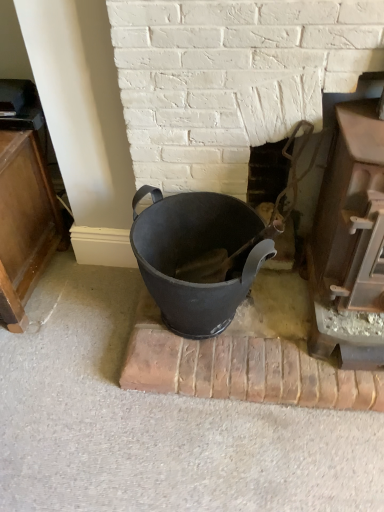
Image resolution: width=384 pixels, height=512 pixels. Find the location of `vacant area that lies in front of smooth metal fireplace at center, marked as the second fireplace in a right-to-left arrangement`. vacant area that lies in front of smooth metal fireplace at center, marked as the second fireplace in a right-to-left arrangement is located at coordinates (291, 324).